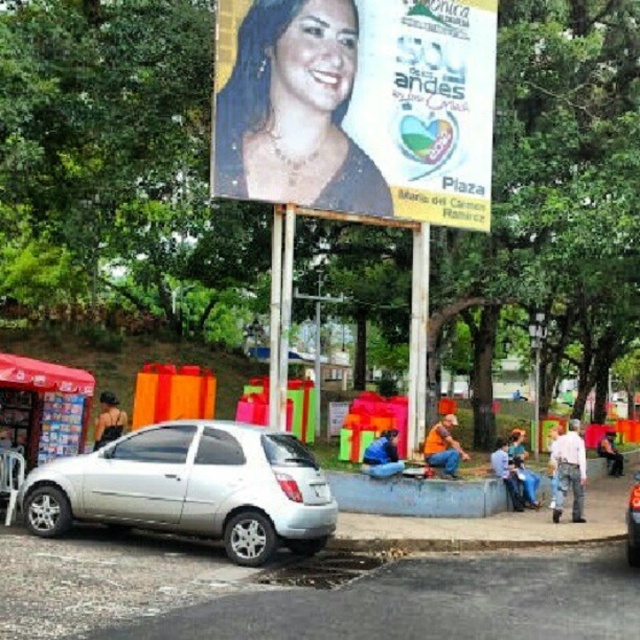
From the picture: You are a delivery person who needs to park your 1.8 meters wide delivery van between the silver metallic hatchback at lower left and the smooth leather jacket at lower right. Based on the scene, can you safely park your van there?

The silver metallic hatchback at lower left might be wider than smooth leather jacket at lower right. Since the hatchback could be wider, there might not be enough space for the 1.8 meters wide delivery van between them. It is uncertain and risky to attempt parking there without knowing the exact width difference.

You are standing at the center of the scene and want to reach the silver metallic hatchback at lower left. Which direction should you move in?

You should move to the lower left direction to reach the silver metallic hatchback at lower left.